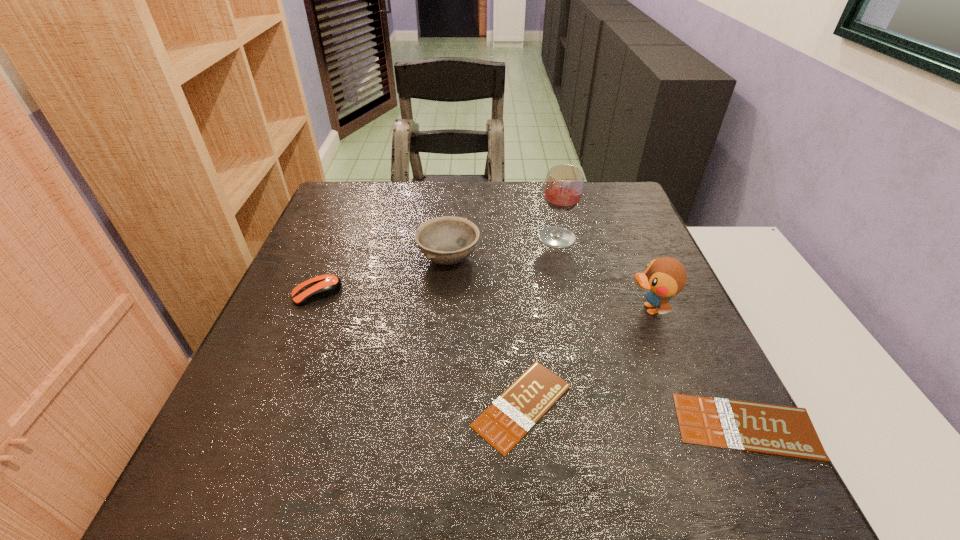
You are a GUI agent. You are given a task and a screenshot of the screen. Output one action in this format:
    pyautogui.click(x=<x>, y=<y>)
    Task: Click on the unoccupied position between the shortest object and the bowl
    Image resolution: width=960 pixels, height=540 pixels.
    Given the screenshot: What is the action you would take?
    pyautogui.click(x=485, y=332)

Locate an element on the screen. empty space that is in between the tallest object and the leftmost object is located at coordinates (437, 265).

This screenshot has width=960, height=540. What are the coordinates of `vacant space that is in between the fifth shortest object and the leftmost object` in the screenshot? It's located at (483, 301).

You are a GUI agent. You are given a task and a screenshot of the screen. Output one action in this format:
    pyautogui.click(x=<x>, y=<y>)
    Task: Click on the unoccupied position between the third tallest object and the fifth shortest object
    This screenshot has height=540, width=960.
    Given the screenshot: What is the action you would take?
    pyautogui.click(x=549, y=284)

Locate an element on the screen. The image size is (960, 540). empty space between the computer mouse and the wineglass is located at coordinates (437, 265).

You are a GUI agent. You are given a task and a screenshot of the screen. Output one action in this format:
    pyautogui.click(x=<x>, y=<y>)
    Task: Click on the vacant space that's between the shorter chocolate bar and the right chocolate bar
    This screenshot has width=960, height=540.
    Given the screenshot: What is the action you would take?
    click(x=634, y=416)

Locate an element on the screen. free area in between the leftmost object and the fourth shortest object is located at coordinates (382, 276).

I want to click on vacant space that's between the computer mouse and the duck, so click(x=483, y=301).

Where is `the fourth closest object to the second shortest object`? The height and width of the screenshot is (540, 960). the fourth closest object to the second shortest object is located at coordinates (447, 240).

Locate which object ranks fifth in proximity to the wineglass. Please provide its 2D coordinates. Your answer should be formatted as a tuple, i.e. [(x, y)], where the tuple contains the x and y coordinates of a point satisfying the conditions above.

[(323, 286)]